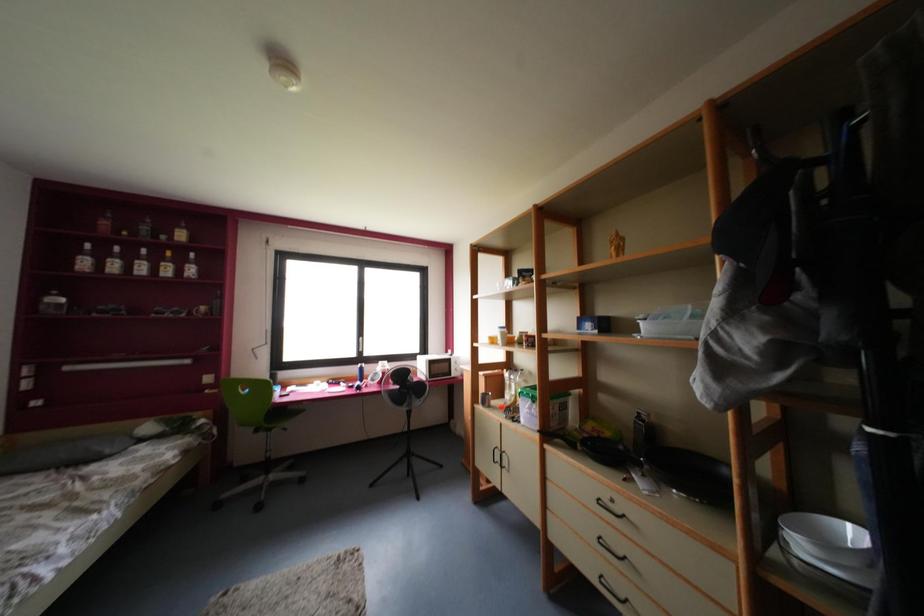
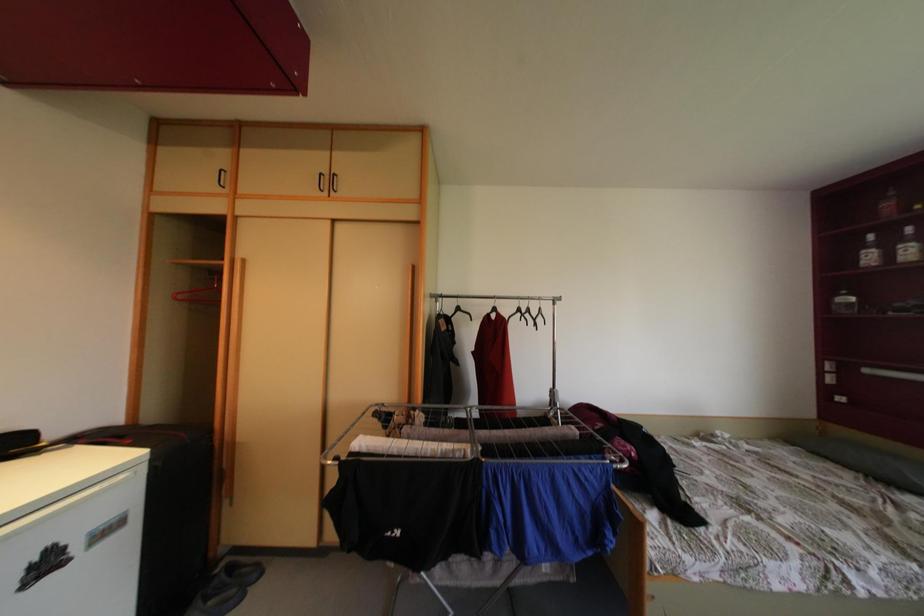
Question: How did the camera likely rotate?

Choices:
 (A) Left
 (B) Right
 (C) Up
 (D) Down

Answer: (A)